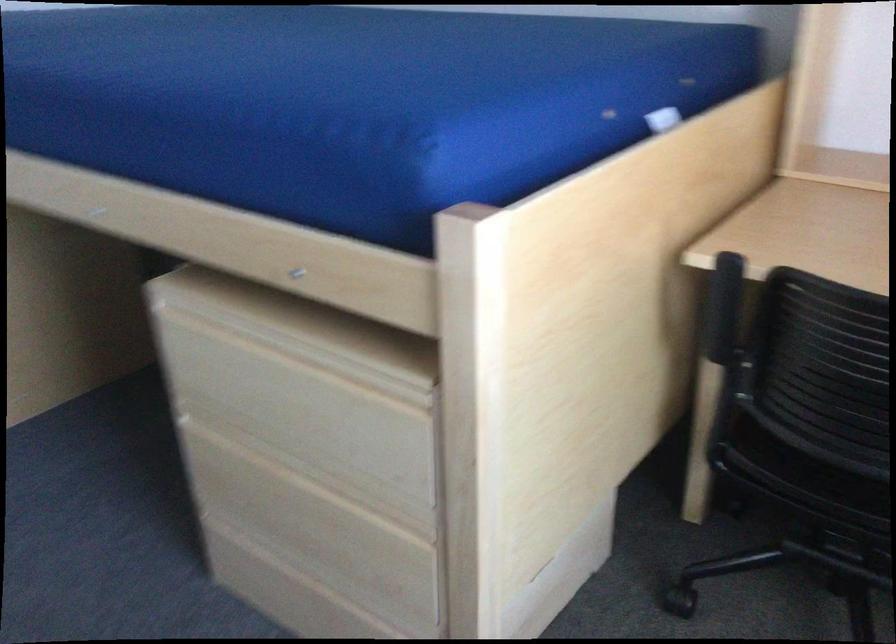
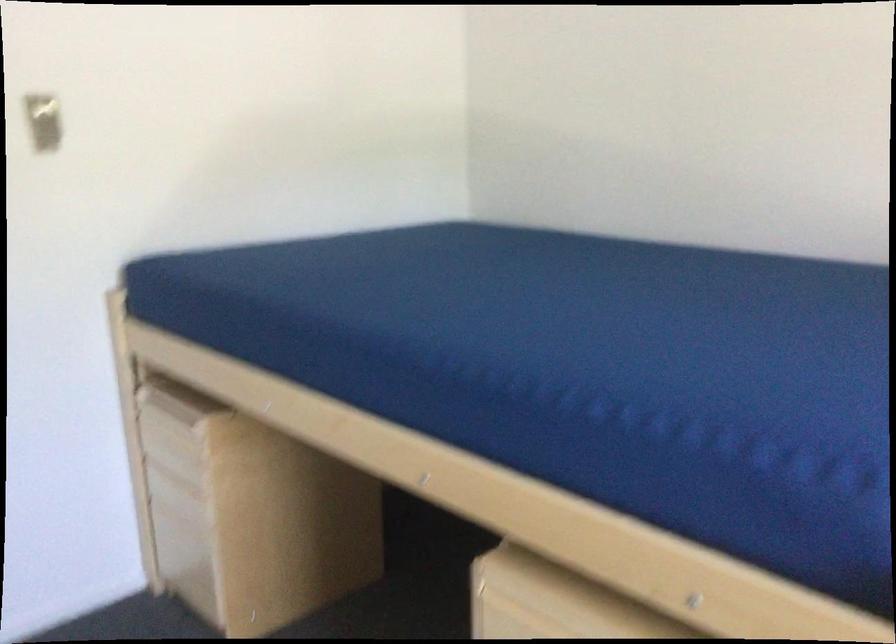
Question: Based on the continuous images, in which direction is the camera rotating? Reply with the corresponding letter.

Choices:
 (A) Left
 (B) Right
 (C) Up
 (D) Down

Answer: (C)